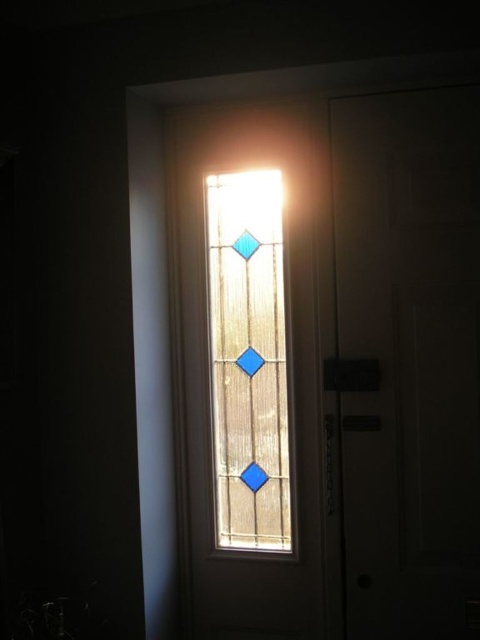
You are standing in a hallway and see the white matte door at right and the translucent stained glass at center. Which object is located higher up in the image?

The translucent stained glass at center is located higher up because the white matte door at right is positioned under it.

You are a painter holding a 12 inch wide canvas. You want to place it between the white matte door at right and the translucent stained glass at center so that it touches both. Is this possible?

The distance between the white matte door at right and the translucent stained glass at center is 11.38 inches. Since the canvas is 12 inches wide, it cannot fit between them while touching both because the distance is shorter than the canvas width.

You are standing in a hallway and see the white matte door at right and the translucent stained glass at center. Which object is taller?

The white matte door at right is taller than the translucent stained glass at center.